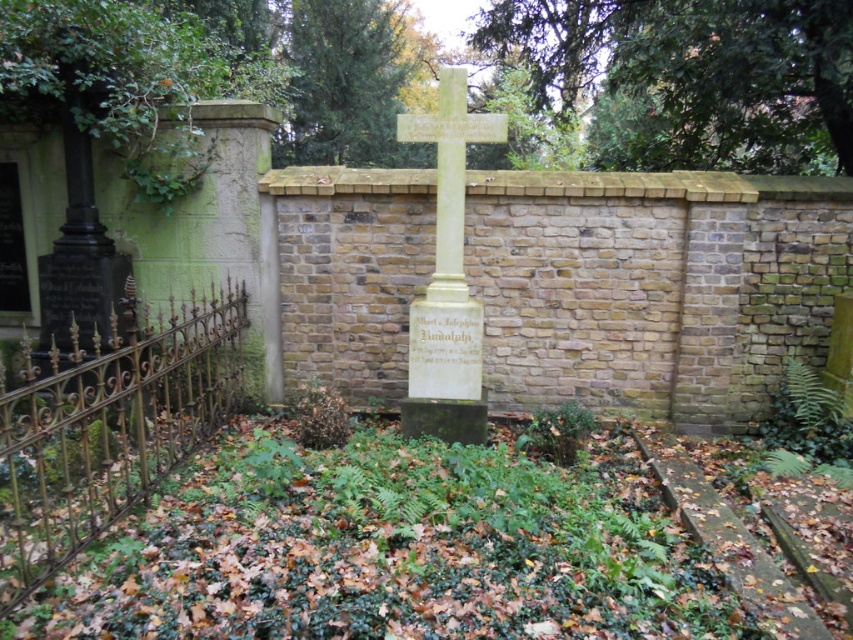
Is gold wrought iron fence at left smaller than light yellow stone cross at center?

Actually, gold wrought iron fence at left might be larger than light yellow stone cross at center.

Who is more distant from viewer, (126, 352) or (438, 337)?

The point (438, 337) is more distant.

You are a GUI agent. You are given a task and a screenshot of the screen. Output one action in this format:
    pyautogui.click(x=<x>, y=<y>)
    Task: Click on the gold wrought iron fence at left
    The image size is (853, 640).
    Given the screenshot: What is the action you would take?
    pyautogui.click(x=108, y=428)